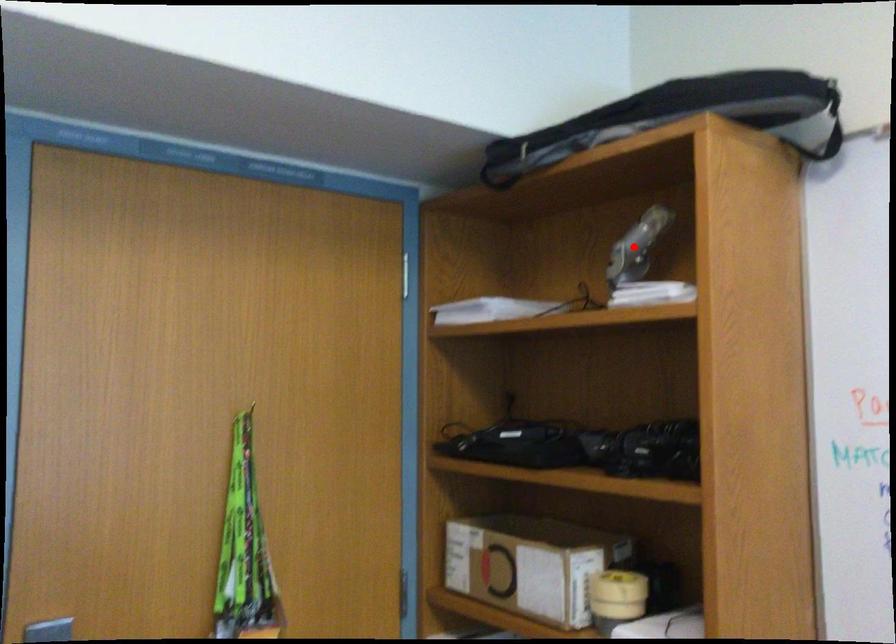
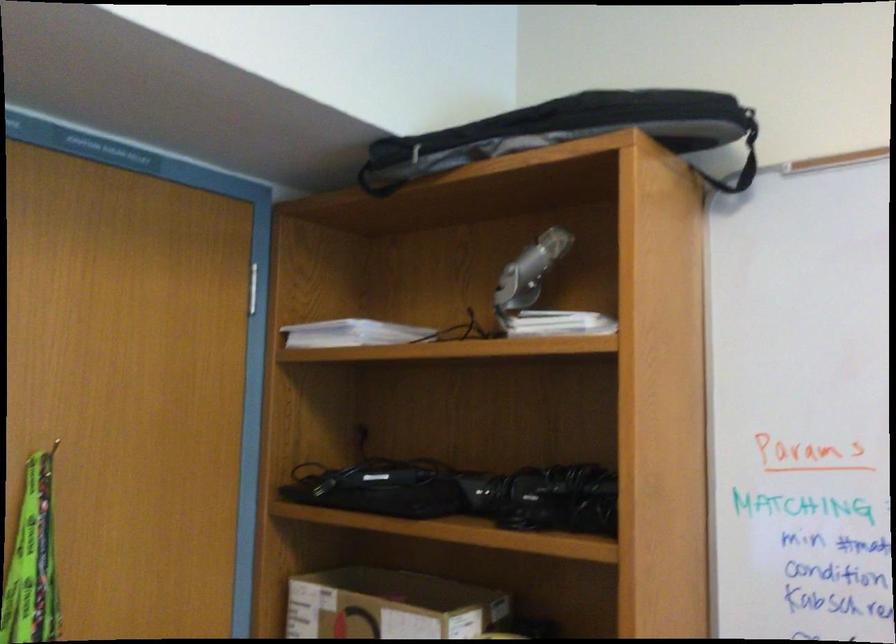
Question: I am providing you with two images of the same scene from different viewpoints. Given a red point in image1, look at the same physical point in image2. Is it:

Choices:
 (A) Closer to the viewpoint
 (B) Farther from the viewpoint

Answer: (A)